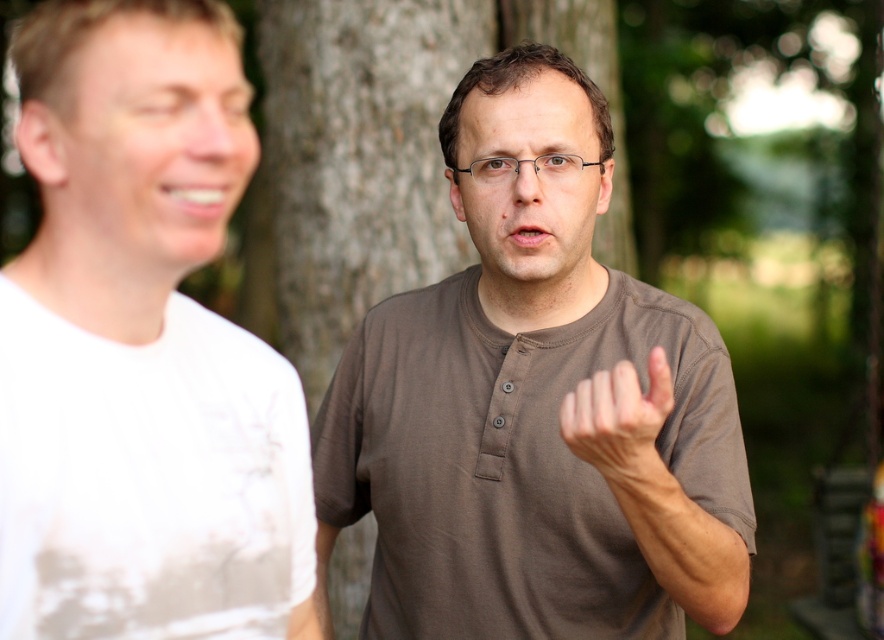
Question: Which point is farther from the camera taking this photo?

Choices:
 (A) (639, 436)
 (B) (496, 496)

Answer: (B)

Question: Does brown cotton shirt at center appear on the right side of white matte t-shirt at left?

Choices:
 (A) no
 (B) yes

Answer: (B)

Question: Is brown cotton shirt at center below white matte t-shirt at left?

Choices:
 (A) yes
 (B) no

Answer: (B)

Question: Can you confirm if brown cotton shirt at center is positioned to the right of matte brown hand at center?

Choices:
 (A) yes
 (B) no

Answer: (B)

Question: Which point is closer to the camera?

Choices:
 (A) white matte t-shirt at left
 (B) matte brown hand at center
 (C) brown cotton shirt at center

Answer: (A)

Question: Which of the following is the closest to the observer?

Choices:
 (A) (513, 358)
 (B) (136, 19)

Answer: (B)